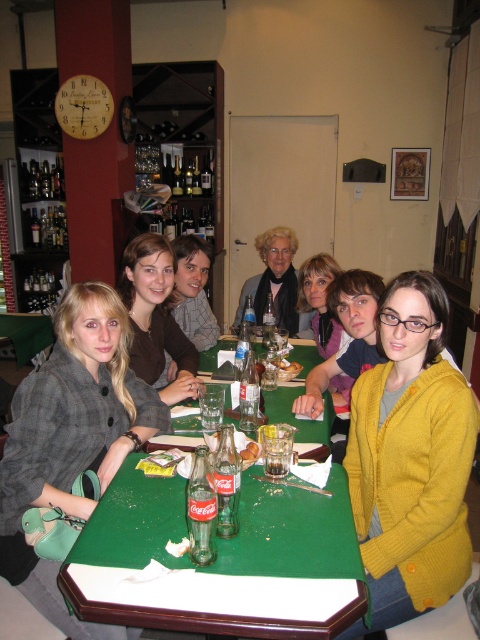
In the scene shown: You are a server at the restaurant and need to deliver a tray of drinks to the table. However, there is a gray wool coat at center in the way. Can you move the coat to access the green fabric table at lower left?

The gray wool coat at center is below the green fabric table at lower left, so moving the coat would allow access to the table.

You are a server in a restaurant. You need to place a new order of drinks on the table. However, there is a mustard yellow cardigan at center on the table. Can you place the drinks on the green fabric table at lower left without moving the cardigan?

The mustard yellow cardigan at center is below green fabric table at lower left, so the cardigan is under the table. Therefore, you can place the drinks on the green fabric table at lower left without moving the cardigan.